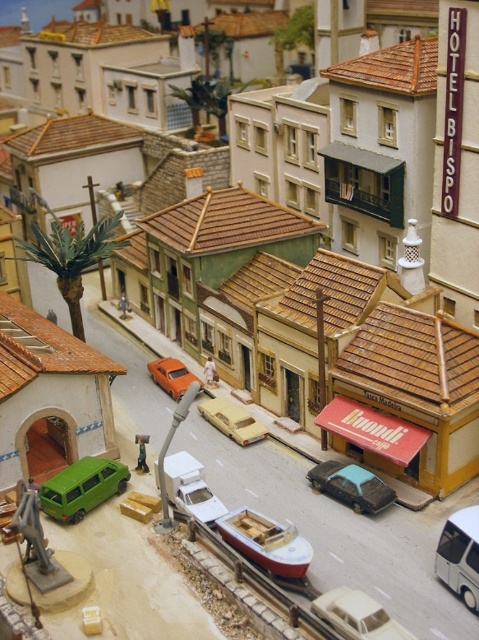
Question: Is red matte boat at center to the right of matte black car at center from the viewer's perspective?

Choices:
 (A) yes
 (B) no

Answer: (B)

Question: Is metallic statue at lower left thinner than light beige plastic car at center?

Choices:
 (A) no
 (B) yes

Answer: (B)

Question: Which is farther from the metallic statue at lower left?

Choices:
 (A) white matte sedan at center
 (B) light beige plastic car at center
 (C) red matte boat at center
 (D) smooth metal train track at center

Answer: (B)

Question: Which object appears farthest from the camera in this image?

Choices:
 (A) red matte boat at center
 (B) metallic silver van at center

Answer: (A)

Question: Is red matte boat at center bigger than smooth metal train track at center?

Choices:
 (A) no
 (B) yes

Answer: (B)

Question: Which point is farther from the camera taking this photo?

Choices:
 (A) (36, 588)
 (B) (400, 637)
 (C) (247, 440)

Answer: (C)